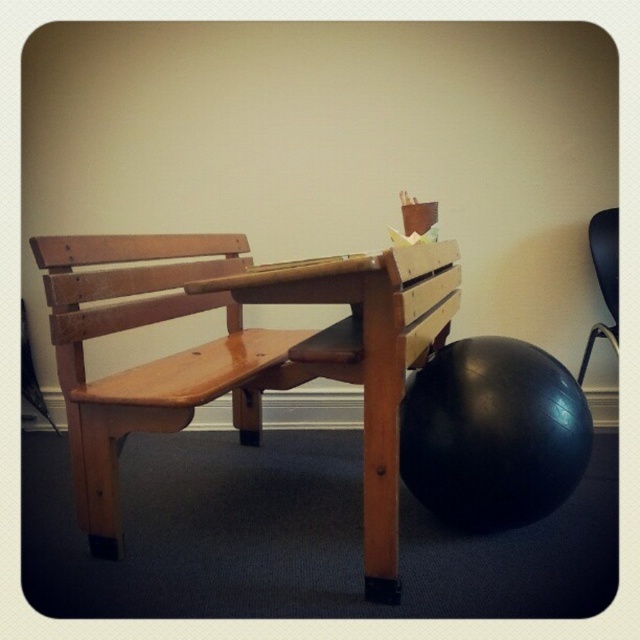
Between wooden bench at center and black matte chair at right, which one is positioned lower?

wooden bench at center

Between wooden bench at center and black matte chair at right, which one has less height?

Standing shorter between the two is black matte chair at right.

Measure the distance between wooden bench at center and camera.

A distance of 97.66 centimeters exists between wooden bench at center and camera.

At what (x,y) coordinates should I click in order to perform the action: click on wooden bench at center. Please return your answer as a coordinate pair (x, y). The width and height of the screenshot is (640, 640). Looking at the image, I should click on (362, 356).

From the picture: Does light brown wood bench at center appear over black rubber ball at lower right?

Yes, light brown wood bench at center is above black rubber ball at lower right.

Who is taller, light brown wood bench at center or black rubber ball at lower right?

Standing taller between the two is light brown wood bench at center.

Does point (45, 276) come in front of point (493, 461)?

That is True.

At what (x,y) coordinates should I click in order to perform the action: click on light brown wood bench at center. Please return your answer as a coordinate pair (x, y). The width and height of the screenshot is (640, 640). Looking at the image, I should click on (148, 362).

Does black rubber ball at lower right appear on the left side of black matte chair at right?

Yes, black rubber ball at lower right is to the left of black matte chair at right.

Does black rubber ball at lower right appear over black matte chair at right?

No.

This screenshot has width=640, height=640. I want to click on black rubber ball at lower right, so click(492, 435).

Where is `black rubber ball at lower right`? The width and height of the screenshot is (640, 640). black rubber ball at lower right is located at coordinates (492, 435).